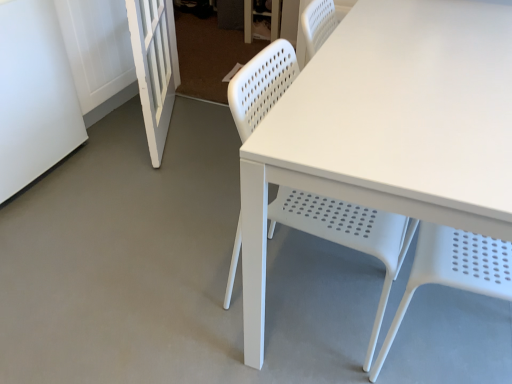
This screenshot has width=512, height=384. I want to click on vacant space that is in between white matte screen door at left, the 1th screen door viewed from the right, and white plastic chair at center, so click(205, 178).